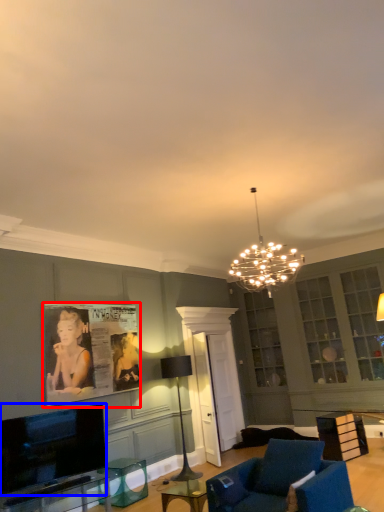
Question: Among these objects, which one is nearest to the camera, picture frame (highlighted by a red box) or television (highlighted by a blue box)?

Choices:
 (A) picture frame
 (B) television

Answer: (B)